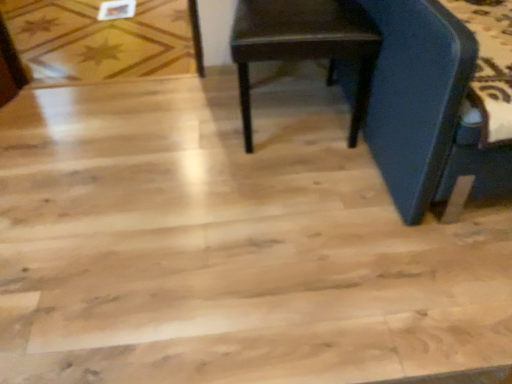
Question: Is dark brown wood chair at center positioned in front of wooden star-patterned floor at upper left?

Choices:
 (A) yes
 (B) no

Answer: (A)

Question: From a real-world perspective, is dark brown wood chair at center below wooden star-patterned floor at upper left?

Choices:
 (A) no
 (B) yes

Answer: (A)

Question: Does dark brown wood chair at center have a greater width compared to wooden star-patterned floor at upper left?

Choices:
 (A) no
 (B) yes

Answer: (A)

Question: Considering the relative positions of dark brown wood chair at center and wooden star-patterned floor at upper left in the image provided, is dark brown wood chair at center to the right of wooden star-patterned floor at upper left from the viewer's perspective?

Choices:
 (A) yes
 (B) no

Answer: (A)

Question: Is the position of dark brown wood chair at center more distant than that of wooden star-patterned floor at upper left?

Choices:
 (A) no
 (B) yes

Answer: (A)

Question: Is dark brown wood chair at center turned away from wooden star-patterned floor at upper left?

Choices:
 (A) yes
 (B) no

Answer: (B)

Question: Does wooden star-patterned floor at upper left come behind dark brown wood chair at center?

Choices:
 (A) yes
 (B) no

Answer: (A)

Question: Considering the relative sizes of wooden star-patterned floor at upper left and dark brown wood chair at center in the image provided, is wooden star-patterned floor at upper left thinner than dark brown wood chair at center?

Choices:
 (A) yes
 (B) no

Answer: (B)

Question: Is there a large distance between wooden star-patterned floor at upper left and dark brown wood chair at center?

Choices:
 (A) yes
 (B) no

Answer: (A)

Question: Can you confirm if wooden star-patterned floor at upper left is smaller than dark brown wood chair at center?

Choices:
 (A) yes
 (B) no

Answer: (A)

Question: Is wooden star-patterned floor at upper left aimed at dark brown wood chair at center?

Choices:
 (A) no
 (B) yes

Answer: (A)

Question: Considering the relative sizes of wooden star-patterned floor at upper left and dark brown wood chair at center in the image provided, is wooden star-patterned floor at upper left taller than dark brown wood chair at center?

Choices:
 (A) yes
 (B) no

Answer: (B)

Question: Choose the correct answer: Is wooden star-patterned floor at upper left inside dark brown wood chair at center or outside it?

Choices:
 (A) outside
 (B) inside

Answer: (A)